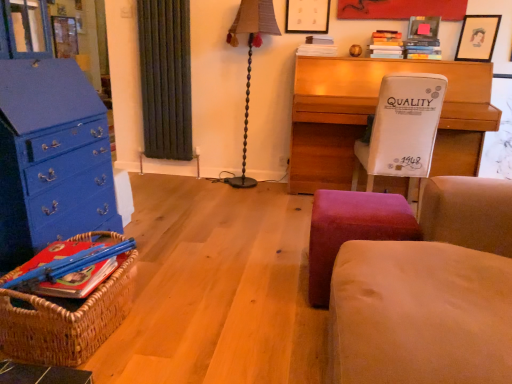
This screenshot has height=384, width=512. Identify the location of free space underneath brown fabric lampshade at center (from a real-world perspective). (250, 181).